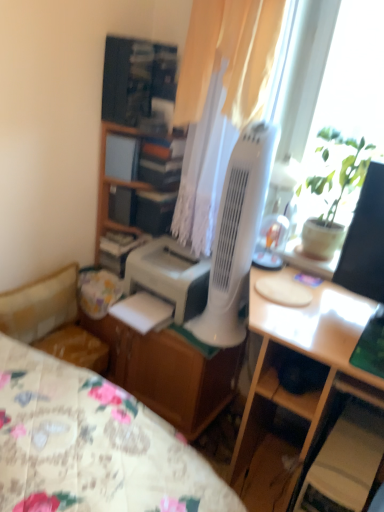
Question: Is green leafy plant at upper right situated inside wooden cabinet at center-left or outside?

Choices:
 (A) outside
 (B) inside

Answer: (A)

Question: In terms of height, does green leafy plant at upper right look taller or shorter compared to wooden cabinet at center-left?

Choices:
 (A) tall
 (B) short

Answer: (B)

Question: Estimate the real-world distances between objects in this image. Which object is closer to the white matte printer at center?

Choices:
 (A) wooden cabinet at center-left
 (B) floral fabric studio couch at lower left
 (C) wooden bookshelf at upper center
 (D) white sheer curtain at center
 (E) white plastic mechanical fan at center

Answer: (E)

Question: Considering the real-world distances, which object is farthest from the wooden file cabinet at center?

Choices:
 (A) white sheer curtain at center
 (B) light wood desk at center
 (C) white plastic mechanical fan at center
 (D) white matte printer at center
 (E) floral fabric studio couch at lower left

Answer: (A)